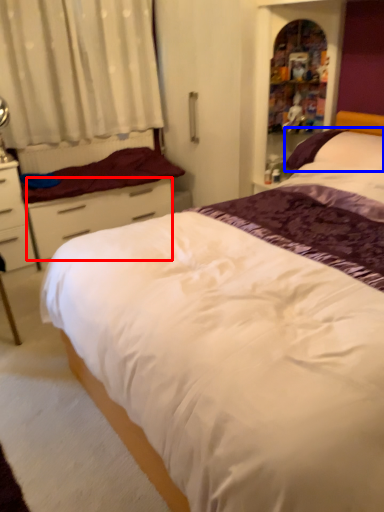
Question: Which object appears closest to the camera in this image, drawer (highlighted by a red box) or pillow (highlighted by a blue box)?

Choices:
 (A) drawer
 (B) pillow

Answer: (B)